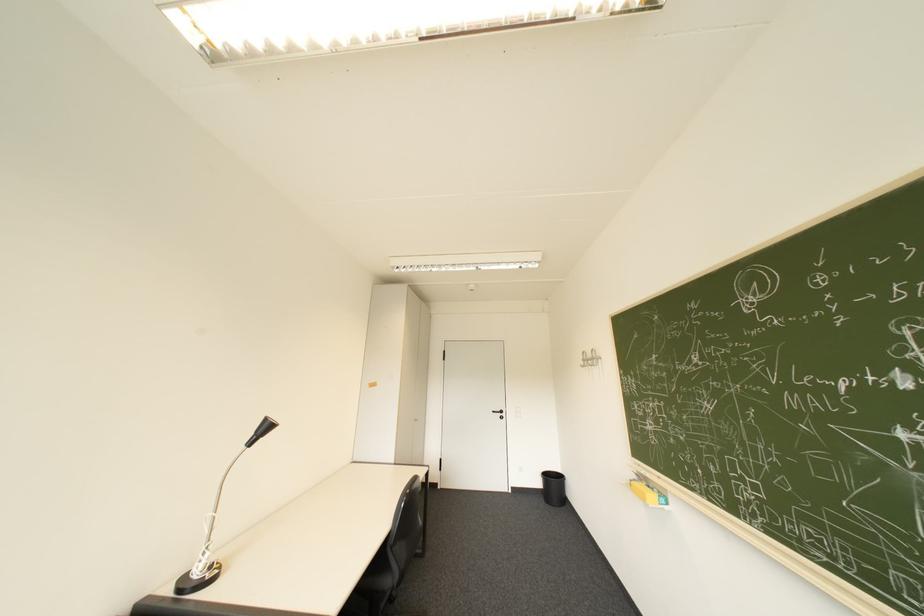
Describe the element at coordinates (499, 413) in the screenshot. The width and height of the screenshot is (924, 616). I see `the cabinet door handle` at that location.